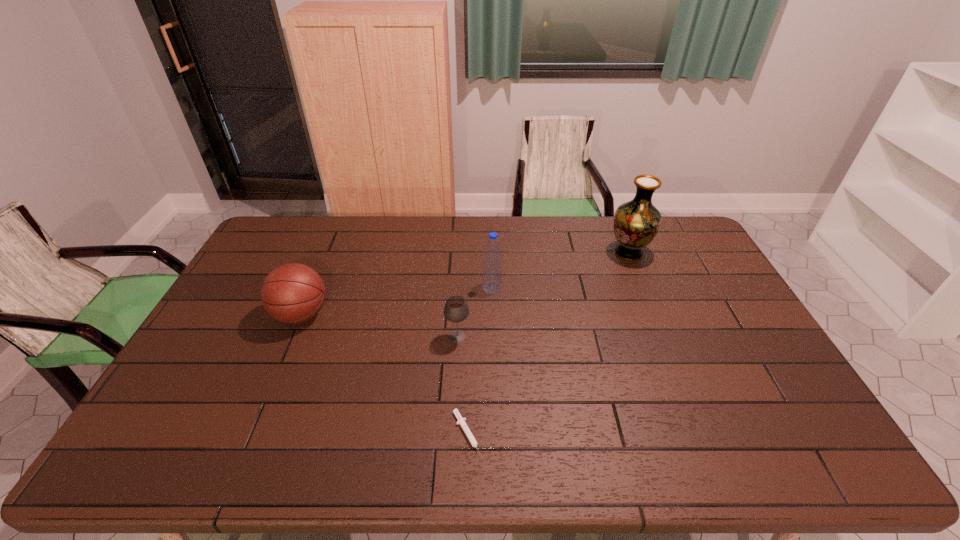
Find the location of a particular element. The height and width of the screenshot is (540, 960). vacant space located on the right of the fourth nearest object is located at coordinates 543,287.

Where is `vacant space located 0.380m on the front of the leftmost object`? vacant space located 0.380m on the front of the leftmost object is located at coordinates (241, 458).

You are a GUI agent. You are given a task and a screenshot of the screen. Output one action in this format:
    pyautogui.click(x=<x>, y=<y>)
    Task: Click on the vacant space located on the right of the fourth tallest object
    Image resolution: width=960 pixels, height=540 pixels.
    Given the screenshot: What is the action you would take?
    pyautogui.click(x=550, y=336)

Identify the location of free point located 0.120m on the back of the shortest object. The width and height of the screenshot is (960, 540). (469, 373).

Locate an element on the screen. object that is positioned at the far edge is located at coordinates (636, 223).

Image resolution: width=960 pixels, height=540 pixels. In order to click on object situated at the near edge in this screenshot , I will do `click(461, 421)`.

Image resolution: width=960 pixels, height=540 pixels. What are the coordinates of `free space at the far edge of the desktop` in the screenshot? It's located at (355, 232).

The height and width of the screenshot is (540, 960). In order to click on vacant space at the near edge of the desktop in this screenshot , I will do `click(573, 454)`.

This screenshot has width=960, height=540. In the image, there is a desktop. Identify the location of vacant space at the left edge. (247, 339).

You are a GUI agent. You are given a task and a screenshot of the screen. Output one action in this format:
    pyautogui.click(x=<x>, y=<y>)
    Task: Click on the free space at the far left corner of the desktop
    This screenshot has width=960, height=540.
    Given the screenshot: What is the action you would take?
    pyautogui.click(x=275, y=238)